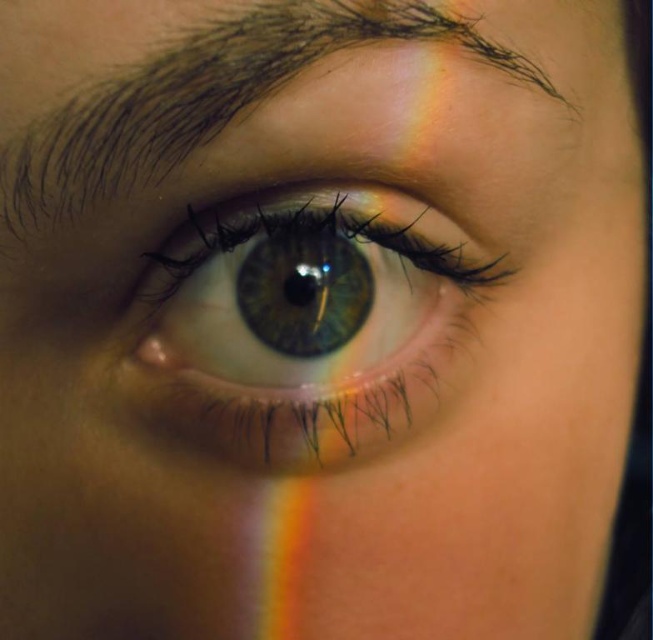
What do you see at coordinates (302, 323) in the screenshot? The height and width of the screenshot is (640, 653). I see `green iridescent eye at center` at bounding box center [302, 323].

Is green iridescent eye at center smaller than brown matte eyebrow at upper center?

Correct, green iridescent eye at center occupies less space than brown matte eyebrow at upper center.

Measure the distance between point (336,404) and camera.

The distance of point (336,404) from camera is 12.40 inches.

At what (x,y) coordinates should I click in order to perform the action: click on green iridescent eye at center. Please return your answer as a coordinate pair (x, y). The image size is (653, 640). Looking at the image, I should click on (302, 323).